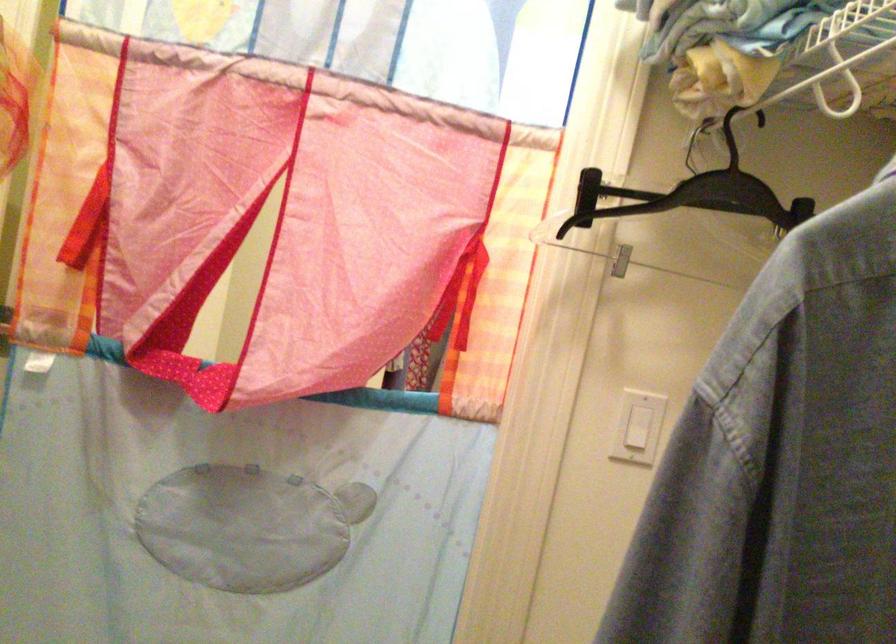
In order to click on pink fabric flap in this screenshot , I will do `click(188, 375)`.